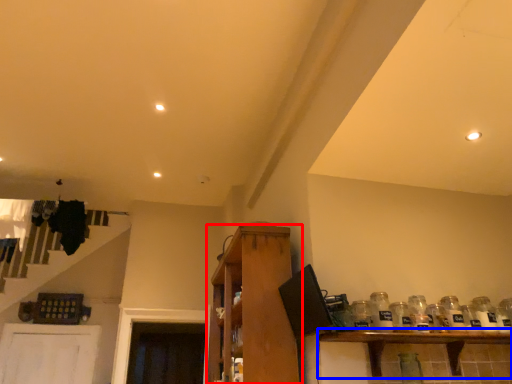
Question: Which object is further to the camera taking this photo, shelf (highlighted by a red box) or shelf (highlighted by a blue box)?

Choices:
 (A) shelf
 (B) shelf

Answer: (A)